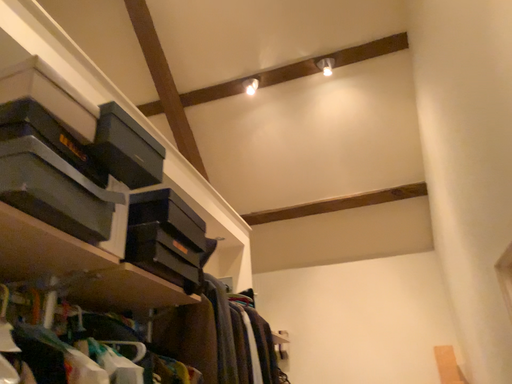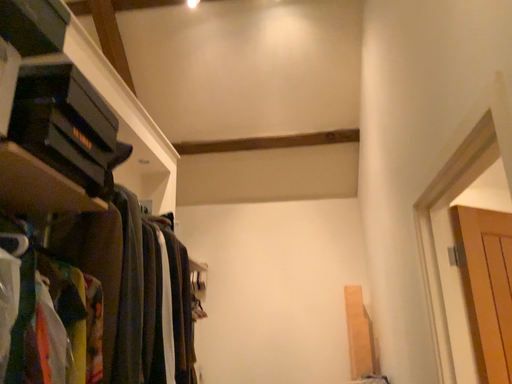
Question: How did the camera likely rotate when shooting the video?

Choices:
 (A) rotated upward
 (B) rotated downward

Answer: (B)